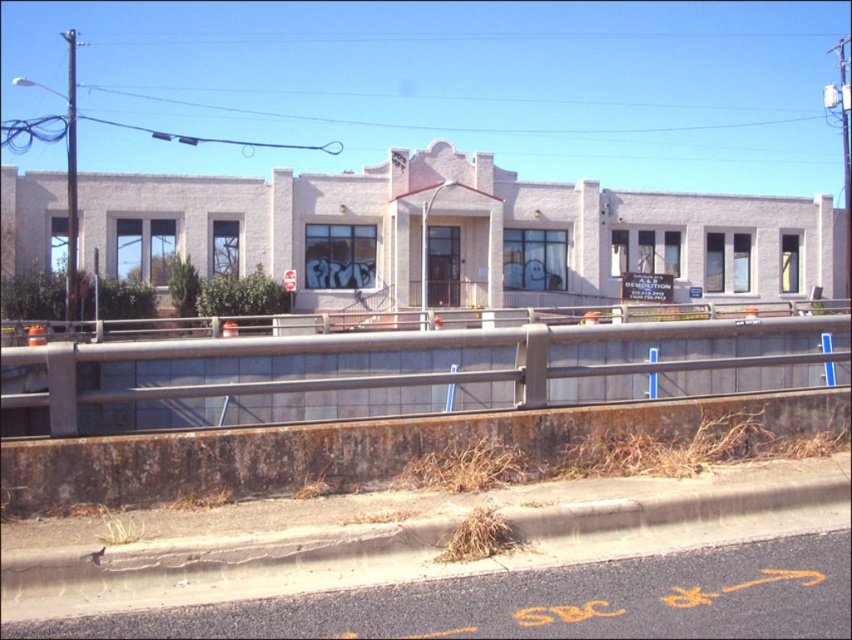
Which is more to the right, rusty metal rail at center or concrete curb at lower center?

From the viewer's perspective, rusty metal rail at center appears more on the right side.

Which of these two, rusty metal rail at center or concrete curb at lower center, stands shorter?

With less height is concrete curb at lower center.

The height and width of the screenshot is (640, 852). I want to click on rusty metal rail at center, so click(412, 371).

Does concrete curb at lower center have a greater width compared to rusty concrete curb at lower center?

Yes, concrete curb at lower center is wider than rusty concrete curb at lower center.

Who is taller, concrete curb at lower center or rusty concrete curb at lower center?

Standing taller between the two is rusty concrete curb at lower center.

Does point (511, 556) come behind point (291, 426)?

No, it is in front of (291, 426).

Where is `concrete curb at lower center`? concrete curb at lower center is located at coordinates (410, 547).

Can you confirm if rusty metal rail at center is shorter than rusty concrete curb at lower center?

In fact, rusty metal rail at center may be taller than rusty concrete curb at lower center.

How much distance is there between rusty metal rail at center and rusty concrete curb at lower center?

rusty metal rail at center and rusty concrete curb at lower center are 13.19 meters apart.

What are the coordinates of `rusty metal rail at center` in the screenshot? It's located at (412, 371).

Image resolution: width=852 pixels, height=640 pixels. Find the location of `rusty metal rail at center`. rusty metal rail at center is located at coordinates (412, 371).